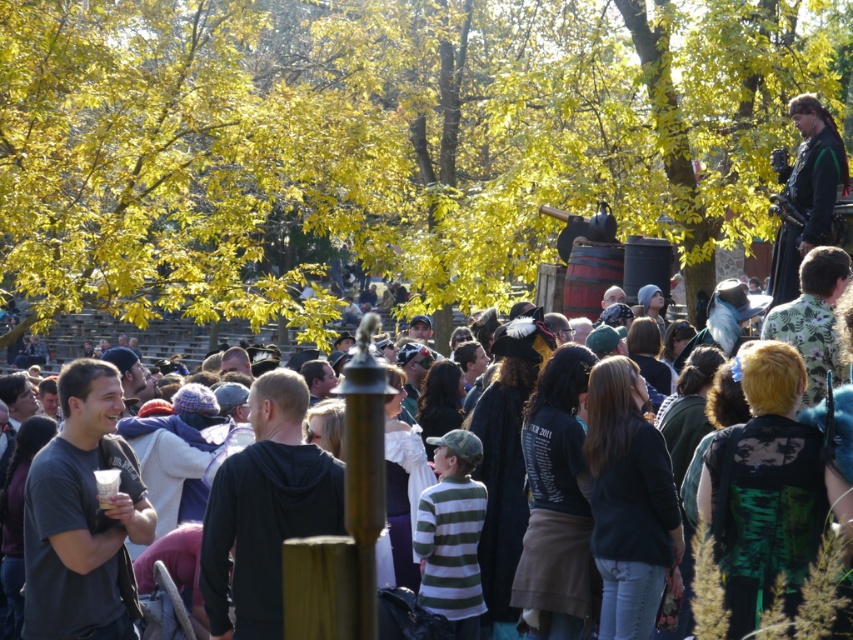
The width and height of the screenshot is (853, 640). Describe the element at coordinates (380, 141) in the screenshot. I see `yellow leafy tree at upper center` at that location.

Does yellow leafy tree at upper center appear on the left side of dark green leather jacket at upper right?

Yes, yellow leafy tree at upper center is to the left of dark green leather jacket at upper right.

The image size is (853, 640). I want to click on yellow leafy tree at upper center, so click(x=380, y=141).

Who is shorter, yellow leafy tree at upper center or black matte t-shirt at left?

Standing shorter between the two is black matte t-shirt at left.

Can you confirm if yellow leafy tree at upper center is wider than black matte t-shirt at left?

Yes.

Identify the location of yellow leafy tree at upper center. click(380, 141).

Does point (611, 144) come closer to viewer compared to point (811, 595)?

No, (611, 144) is behind (811, 595).

Between yellow leafy tree at upper center and dark brown leather jacket at center, which one is positioned higher?

Positioned higher is yellow leafy tree at upper center.

Where is `yellow leafy tree at upper center`? yellow leafy tree at upper center is located at coordinates (380, 141).

Locate an element on the screen. This screenshot has width=853, height=640. yellow leafy tree at upper center is located at coordinates (380, 141).